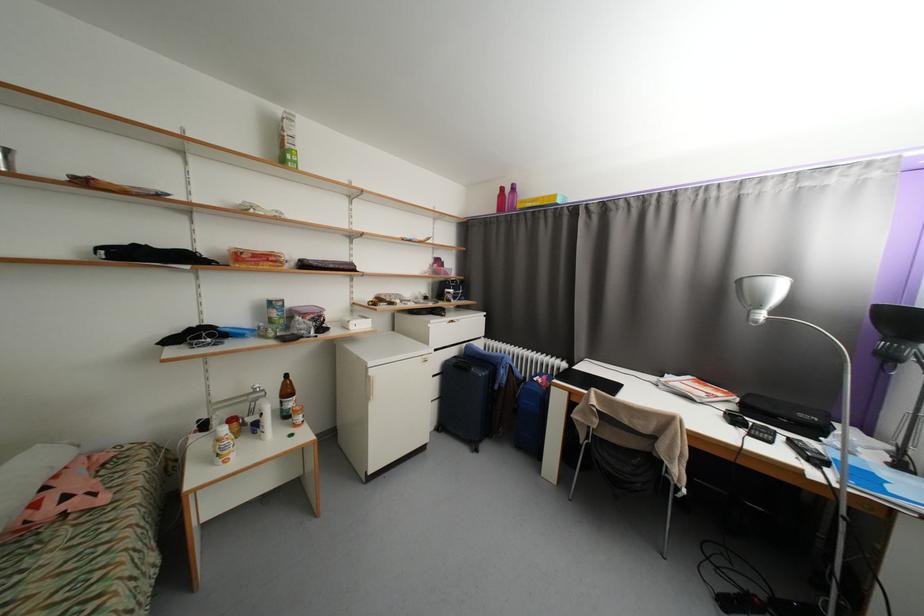
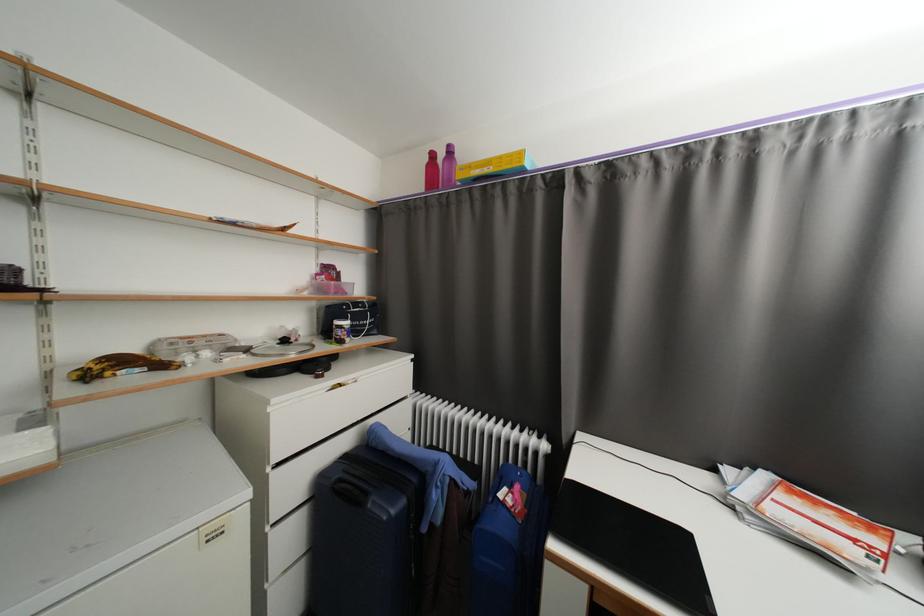
The point at (397, 304) is marked in the first image. Where is the corresponding point in the second image?

(167, 367)